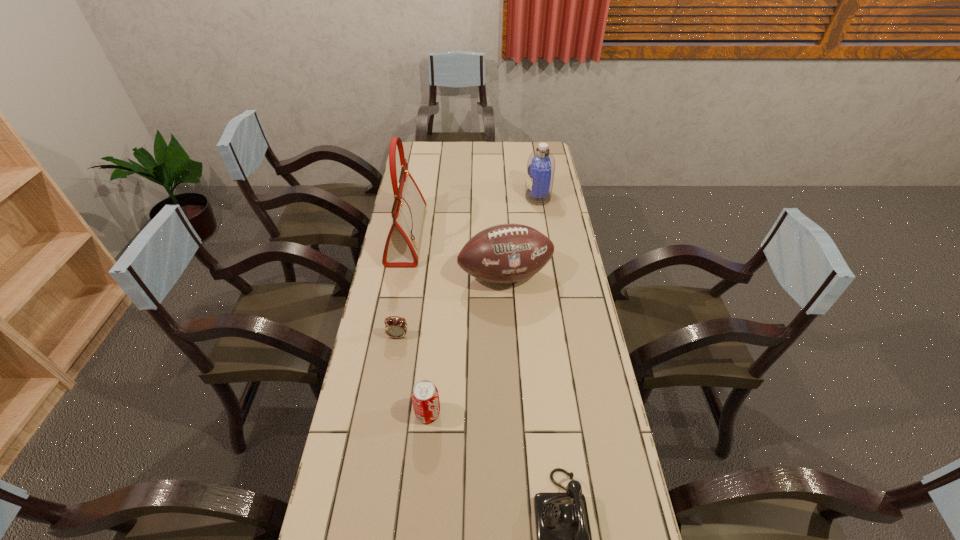
Find the location of a particular element. The image size is (960, 540). vacant space positioned on the face of the fourth farthest object is located at coordinates (385, 414).

What are the coordinates of `handbag that is at the left edge` in the screenshot? It's located at (401, 248).

Where is `alarm clock situated at the left edge`? alarm clock situated at the left edge is located at coordinates (394, 327).

Image resolution: width=960 pixels, height=540 pixels. I want to click on cleansing agent located at the right edge, so click(541, 163).

The height and width of the screenshot is (540, 960). I want to click on football (American) present at the right edge, so click(x=506, y=253).

In the image, there is a desktop. Where is `vacant space at the far edge`? The image size is (960, 540). vacant space at the far edge is located at coordinates (484, 157).

You are a GUI agent. You are given a task and a screenshot of the screen. Output one action in this format:
    pyautogui.click(x=<x>, y=<y>)
    Task: Click on the free region at the left edge
    
    Given the screenshot: What is the action you would take?
    pyautogui.click(x=374, y=393)

You are a GUI agent. You are given a task and a screenshot of the screen. Output one action in this format:
    pyautogui.click(x=<x>, y=<y>)
    Task: Click on the vacant space at the right edge of the desktop
    This screenshot has width=960, height=540.
    Given the screenshot: What is the action you would take?
    pyautogui.click(x=586, y=327)

Identify the location of vacant point located between the football (American) and the third shortest object. (467, 345).

Locate an element on the screen. The height and width of the screenshot is (540, 960). empty space between the fourth farthest object and the football (American) is located at coordinates (451, 306).